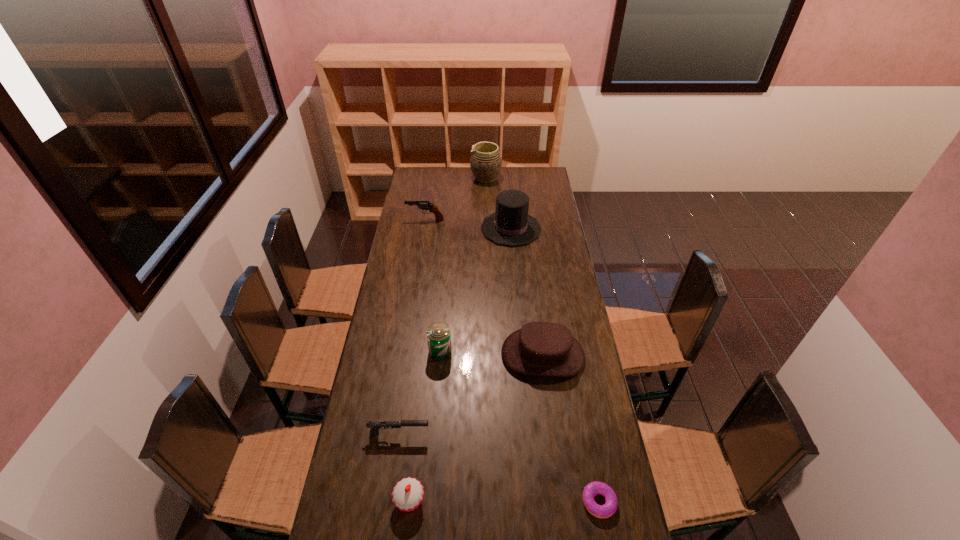
Find the location of a particular element. free space between the can and the doughnut is located at coordinates (x=519, y=427).

Where is `empty space that is in between the shortest object and the can`? empty space that is in between the shortest object and the can is located at coordinates (519, 427).

Identify the location of free space between the shortest object and the nearer hat. Image resolution: width=960 pixels, height=540 pixels. pyautogui.click(x=571, y=429).

This screenshot has height=540, width=960. I want to click on free point between the nearer hat and the second shortest object, so click(470, 394).

Identify which object is the fourth nearest to the nearer hat. Please provide its 2D coordinates. Your answer should be formatted as a tuple, i.e. [(x, y)], where the tuple contains the x and y coordinates of a point satisfying the conditions above.

[(407, 495)]

The width and height of the screenshot is (960, 540). I want to click on object that ranks as the fourth closest to the cupcake, so pos(592,489).

The image size is (960, 540). I want to click on vacant position in the image that satisfies the following two spatial constraints: 1. on the front of the doughnut with the decoration; 2. on the left side of the taller hat, so click(x=534, y=502).

Where is `free spot that satisfies the following two spatial constraints: 1. on the front of the taller hat with the decoration; 2. on the front side of the cupcake`? Image resolution: width=960 pixels, height=540 pixels. free spot that satisfies the following two spatial constraints: 1. on the front of the taller hat with the decoration; 2. on the front side of the cupcake is located at coordinates (534, 501).

You are a GUI agent. You are given a task and a screenshot of the screen. Output one action in this format:
    pyautogui.click(x=<x>, y=<y>)
    Task: Click on the vacant region that satisfies the following two spatial constraints: 1. on the front of the taller hat with the decoration; 2. on the right side of the shorter hat
    Image resolution: width=960 pixels, height=540 pixels.
    Given the screenshot: What is the action you would take?
    pyautogui.click(x=521, y=355)

You are a GUI agent. You are given a task and a screenshot of the screen. Output one action in this format:
    pyautogui.click(x=<x>, y=<y>)
    Task: Click on the free spot that satisfies the following two spatial constraints: 1. along the barrel of the pottery; 2. on the right side of the farther gun
    The height and width of the screenshot is (540, 960).
    Given the screenshot: What is the action you would take?
    pyautogui.click(x=432, y=178)